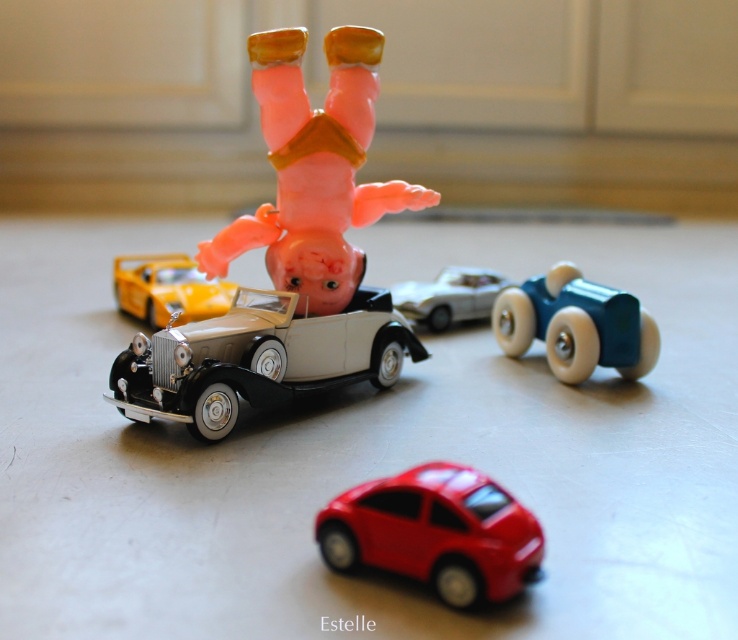
Is the position of black glossy vintage car at center more distant than that of satin silver car at center?

That is False.

Who is more distant from viewer, (x=292, y=308) or (x=451, y=268)?

The point (x=451, y=268) is more distant.

Find the location of `black glossy vintage car at center`. black glossy vintage car at center is located at coordinates (258, 358).

Is pink rubber figure at center positioned before shiny yellow car at center?

Yes, pink rubber figure at center is closer to the viewer.

Is pink rubber figure at center behind shiny yellow car at center?

No, pink rubber figure at center is closer to the viewer.

Is point (331, 256) behind point (206, 289)?

No, it is in front of (206, 289).

Locate an element on the screen. pink rubber figure at center is located at coordinates (314, 170).

Does shiny red car at center appear over satin silver car at center?

No, shiny red car at center is not above satin silver car at center.

Can you confirm if shiny red car at center is taller than satin silver car at center?

No, shiny red car at center is not taller than satin silver car at center.

Who is more distant from viewer, (482, 564) or (461, 273)?

Point (461, 273)

Where is `shiny red car at center`? shiny red car at center is located at coordinates (435, 532).